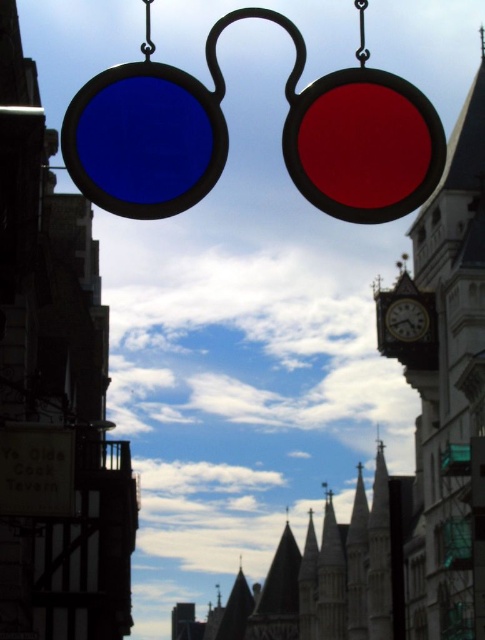
You are a tourist standing in the middle of the street looking at the smooth stone clock tower at right and the wooden clock at center. Which clock is larger?

The smooth stone clock tower at right is bigger than the wooden clock at center.

You are a tourist standing in the street looking at the smooth stone clock tower at right and the wooden clock at center. Which one is taller?

The smooth stone clock tower at right is taller than the wooden clock at center.